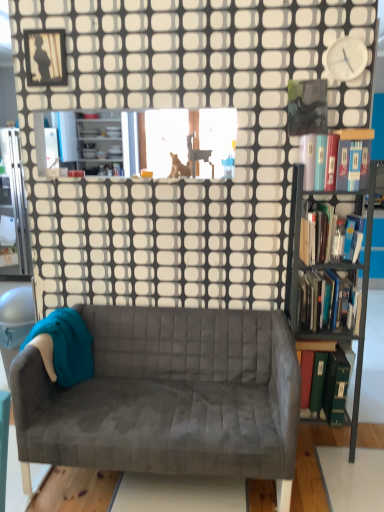
Question: Considering the relative positions of white plastic clock at upper right and metallic black bookcase at right in the image provided, is white plastic clock at upper right to the right of metallic black bookcase at right from the viewer's perspective?

Choices:
 (A) no
 (B) yes

Answer: (B)

Question: From the image's perspective, is white plastic clock at upper right under metallic black bookcase at right?

Choices:
 (A) yes
 (B) no

Answer: (B)

Question: Is there a large distance between white plastic clock at upper right and metallic black bookcase at right?

Choices:
 (A) no
 (B) yes

Answer: (A)

Question: Is white plastic clock at upper right bigger than metallic black bookcase at right?

Choices:
 (A) yes
 (B) no

Answer: (B)

Question: Can you confirm if white plastic clock at upper right is wider than metallic black bookcase at right?

Choices:
 (A) no
 (B) yes

Answer: (A)

Question: Is point (170, 342) positioned closer to the camera than point (321, 187)?

Choices:
 (A) farther
 (B) closer

Answer: (A)

Question: Considering their positions, is velvet gray couch at center located in front of or behind hardcover book at right, which is counted as the 1th book, starting from the top?

Choices:
 (A) front
 (B) behind

Answer: (A)

Question: Choose the correct answer: Is velvet gray couch at center inside hardcover book at right, the 4th book from the bottom, or outside it?

Choices:
 (A) outside
 (B) inside

Answer: (A)

Question: From a real-world perspective, is velvet gray couch at center positioned above or below hardcover book at right, the 4th book from the bottom?

Choices:
 (A) below
 (B) above

Answer: (A)

Question: From a real-world perspective, relative to brown furry dog at upper center, is velvet gray couch at center vertically above or below?

Choices:
 (A) above
 (B) below

Answer: (B)

Question: Considering the positions of point (213, 432) and point (188, 174), is point (213, 432) closer or farther from the camera than point (188, 174)?

Choices:
 (A) farther
 (B) closer

Answer: (B)

Question: Is velvet gray couch at center taller or shorter than brown furry dog at upper center?

Choices:
 (A) short
 (B) tall

Answer: (B)

Question: Relative to brown furry dog at upper center, is velvet gray couch at center in front or behind?

Choices:
 (A) front
 (B) behind

Answer: (A)

Question: Is metallic black bookcase at right in front of or behind brown furry dog at upper center in the image?

Choices:
 (A) front
 (B) behind

Answer: (A)

Question: Based on their sizes in the image, would you say metallic black bookcase at right is bigger or smaller than brown furry dog at upper center?

Choices:
 (A) big
 (B) small

Answer: (A)